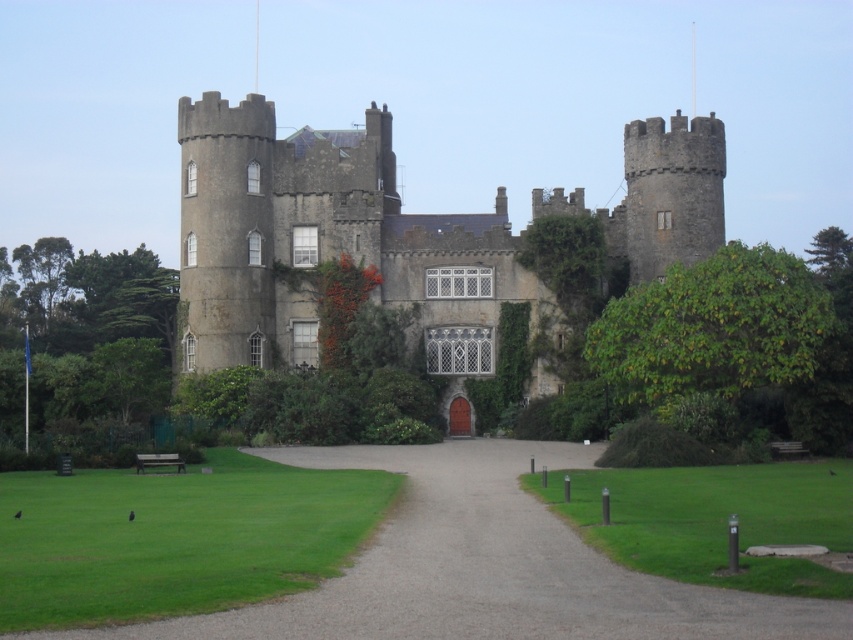
Does gray stone castle at center lie in front of gray gravel driveway at center?

No, it is not.

Measure the distance between gray stone castle at center and gray gravel driveway at center.

gray stone castle at center is 28.95 meters away from gray gravel driveway at center.

Does point (416, 300) come closer to viewer compared to point (643, 627)?

No, (416, 300) is behind (643, 627).

The width and height of the screenshot is (853, 640). In order to click on gray stone castle at center in this screenshot , I will do `click(323, 241)`.